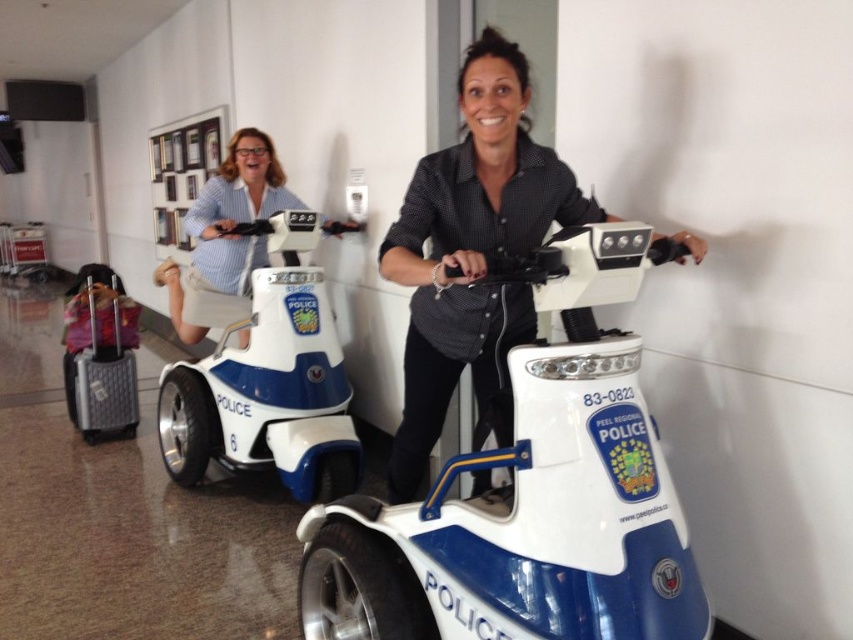
Which is more to the left, white plastic scooter at left or blue glossy police scooter at upper left?

blue glossy police scooter at upper left is more to the left.

Is point (256, 436) more distant than point (210, 196)?

No, (256, 436) is in front of (210, 196).

Image resolution: width=853 pixels, height=640 pixels. I want to click on white plastic scooter at left, so click(268, 381).

Is matte black shirt at center below gray fabric suitcase at lower left?

Actually, matte black shirt at center is above gray fabric suitcase at lower left.

Does matte black shirt at center have a lesser height compared to gray fabric suitcase at lower left?

Incorrect, matte black shirt at center's height does not fall short of gray fabric suitcase at lower left's.

Is point (511, 344) closer to viewer compared to point (94, 368)?

Yes, point (511, 344) is closer to viewer.

Locate an element on the screen. matte black shirt at center is located at coordinates (473, 253).

Is matte black shirt at center closer to camera compared to white plastic scooter at left?

Yes, matte black shirt at center is closer to the viewer.

Is point (471, 236) positioned in front of point (328, 420)?

That is True.

Is point (509, 150) closer to viewer compared to point (267, 346)?

Yes, it is.

Find the location of a particular element. The height and width of the screenshot is (640, 853). matte black shirt at center is located at coordinates (473, 253).